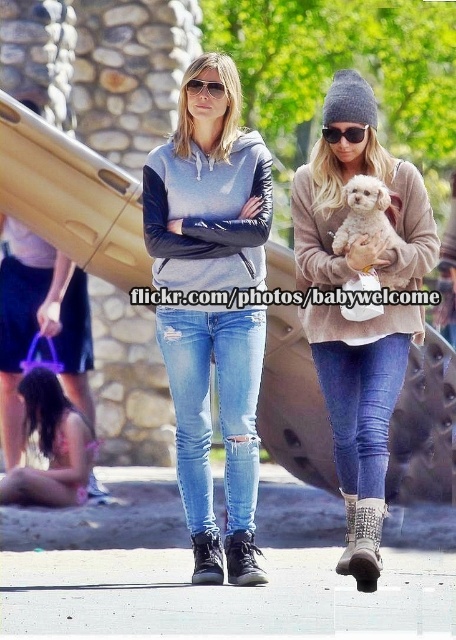
Is light blue distressed jeans at center further to the viewer compared to white fluffy dog at center?

Yes, light blue distressed jeans at center is further from the viewer.

Is light blue distressed jeans at center wider than white fluffy dog at center?

Yes, light blue distressed jeans at center is wider than white fluffy dog at center.

The height and width of the screenshot is (640, 456). What do you see at coordinates (218, 406) in the screenshot? I see `light blue distressed jeans at center` at bounding box center [218, 406].

At what (x,y) coordinates should I click in order to perform the action: click on light blue distressed jeans at center. Please return your answer as a coordinate pair (x, y). This screenshot has height=640, width=456. Looking at the image, I should click on (218, 406).

Between light blue distressed jeans at center and gray hoodie with leather sleeves at center, which one appears on the right side from the viewer's perspective?

light blue distressed jeans at center is more to the right.

Can you confirm if light blue distressed jeans at center is smaller than gray hoodie with leather sleeves at center?

Yes.

You are a GUI agent. You are given a task and a screenshot of the screen. Output one action in this format:
    pyautogui.click(x=<x>, y=<y>)
    Task: Click on the light blue distressed jeans at center
    This screenshot has height=640, width=456.
    Given the screenshot: What is the action you would take?
    pyautogui.click(x=218, y=406)

Does point (388, 378) come in front of point (202, 88)?

Yes.

Between knit gray beanie at upper right and matte black sunglasses at center, which one is positioned lower?

knit gray beanie at upper right

Who is more distant from viewer, (x=335, y=93) or (x=198, y=83)?

Point (x=198, y=83)

At what (x,y) coordinates should I click in order to perform the action: click on knit gray beanie at upper right. Please return your answer as a coordinate pair (x, y). Looking at the image, I should click on (362, 412).